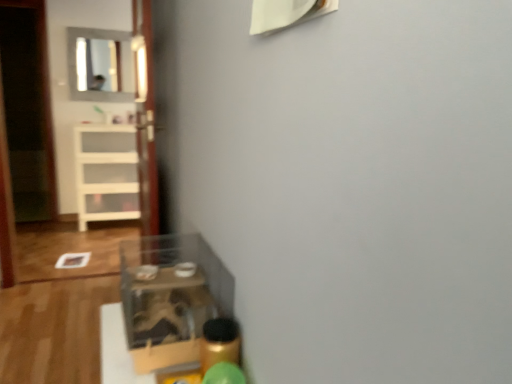
Question: Should I look upward or downward to see transparent glass door at center?

Choices:
 (A) down
 (B) up

Answer: (B)

Question: From the image's perspective, is transparent plastic shelf at lower left, the second shelf from the left, beneath matte glass mirror at upper left?

Choices:
 (A) no
 (B) yes

Answer: (B)

Question: Is transparent plastic shelf at lower left, the second shelf from the left, not inside matte glass mirror at upper left?

Choices:
 (A) yes
 (B) no

Answer: (A)

Question: Can you confirm if transparent plastic shelf at lower left, the second shelf from the back, is smaller than matte glass mirror at upper left?

Choices:
 (A) yes
 (B) no

Answer: (B)

Question: Is transparent plastic shelf at lower left, the second shelf from the left, wider than matte glass mirror at upper left?

Choices:
 (A) no
 (B) yes

Answer: (B)

Question: Is transparent plastic shelf at lower left, which is the first shelf in bottom-to-top order, positioned far away from matte glass mirror at upper left?

Choices:
 (A) yes
 (B) no

Answer: (A)

Question: From a real-world perspective, does transparent plastic shelf at lower left, the 1th shelf from the right, sit lower than matte glass mirror at upper left?

Choices:
 (A) yes
 (B) no

Answer: (A)

Question: Is transparent glass door at center thinner than transparent plastic shelf at lower left, the 2th shelf positioned from the top?

Choices:
 (A) no
 (B) yes

Answer: (B)

Question: From a real-world perspective, does transparent glass door at center sit lower than transparent plastic shelf at lower left, the second shelf from the left?

Choices:
 (A) no
 (B) yes

Answer: (A)

Question: Could you tell me if transparent glass door at center is turned towards transparent plastic shelf at lower left, the second shelf from the left?

Choices:
 (A) yes
 (B) no

Answer: (B)

Question: Is transparent glass door at center not near transparent plastic shelf at lower left, the second shelf from the left?

Choices:
 (A) yes
 (B) no

Answer: (B)

Question: Considering the relative sizes of transparent glass door at center and transparent plastic shelf at lower left, the 2th shelf positioned from the top, in the image provided, is transparent glass door at center taller than transparent plastic shelf at lower left, the 2th shelf positioned from the top,?

Choices:
 (A) yes
 (B) no

Answer: (A)

Question: From the image's perspective, does transparent glass door at center appear higher than transparent plastic shelf at lower left, which is the first shelf in bottom-to-top order?

Choices:
 (A) yes
 (B) no

Answer: (A)

Question: From the image's perspective, is transparent glass door at center on top of matte glass mirror at upper left?

Choices:
 (A) yes
 (B) no

Answer: (B)